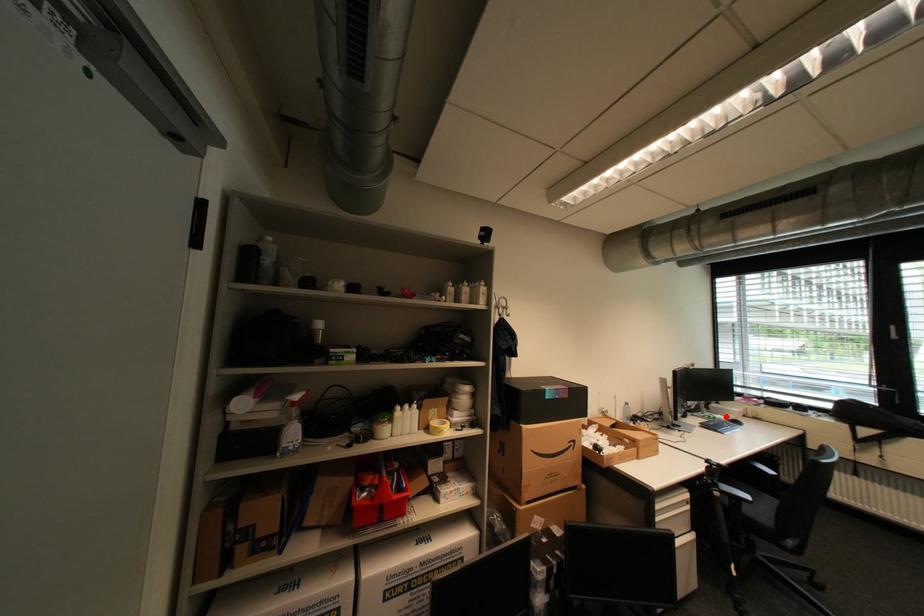
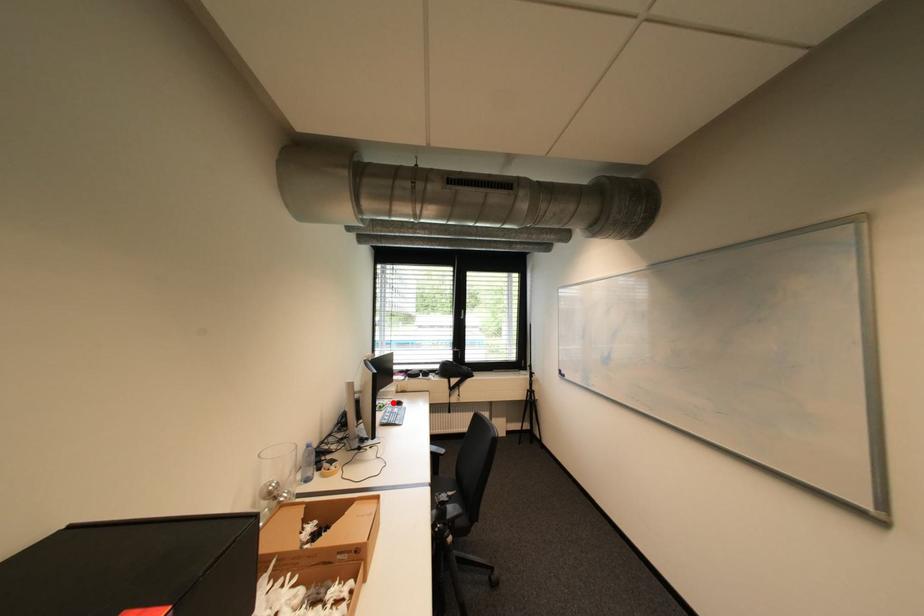
I am providing you with two images of the same scene from different viewpoints. A red point is marked on the first image and another point is marked on the second image. Are the points marked in image1 and image2 representing the same 3D position?

Yes